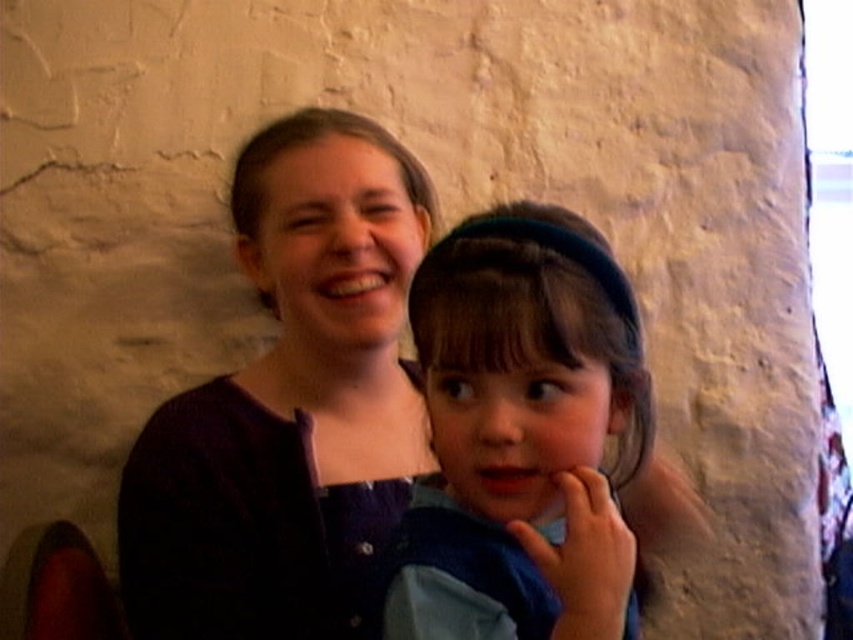
You are designing a new clothing line and need to decide which item to feature first. Given the image of two items, the matte purple sweater at center and the blue fabric at center, which one is wider?

The matte purple sweater at center is wider than the blue fabric at center, so it should be featured first.

You are an artist trying to paint the scene. The point you need to focus on is at coordinates point (289,403). Which object should you focus on to accurately depict the matte purple sweater at center?

The matte purple sweater at center is located at point (289,403), so you should focus on the matte purple sweater at center to accurately depict it.

Where is the matte purple sweater at center located in the image?

The matte purple sweater at center is located at point (289, 403) in the image.